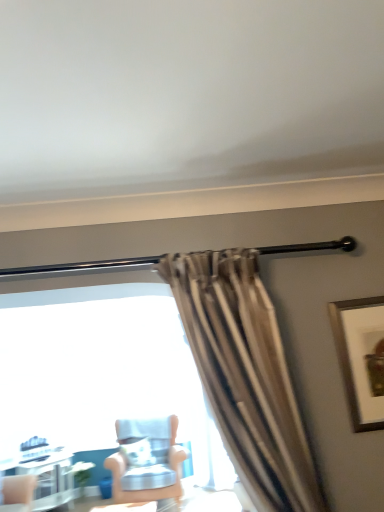
Question: Is wooden framed artwork at upper right oriented towards light blue fabric chair at center?

Choices:
 (A) no
 (B) yes

Answer: (A)

Question: From the image's perspective, is wooden framed artwork at upper right above light blue fabric chair at center?

Choices:
 (A) yes
 (B) no

Answer: (A)

Question: Is wooden framed artwork at upper right thinner than light blue fabric chair at center?

Choices:
 (A) yes
 (B) no

Answer: (A)

Question: Does wooden framed artwork at upper right touch light blue fabric chair at center?

Choices:
 (A) no
 (B) yes

Answer: (A)

Question: From the image's perspective, is wooden framed artwork at upper right below light blue fabric chair at center?

Choices:
 (A) no
 (B) yes

Answer: (A)

Question: Is wooden framed artwork at upper right wider or thinner than light blue fabric chair at center?

Choices:
 (A) thin
 (B) wide

Answer: (A)

Question: Choose the correct answer: Is wooden framed artwork at upper right inside light blue fabric chair at center or outside it?

Choices:
 (A) inside
 (B) outside

Answer: (B)

Question: Is wooden framed artwork at upper right taller or shorter than light blue fabric chair at center?

Choices:
 (A) short
 (B) tall

Answer: (A)

Question: Relative to light blue fabric chair at center, is wooden framed artwork at upper right in front or behind?

Choices:
 (A) behind
 (B) front

Answer: (B)

Question: From the image's perspective, relative to wooden framed artwork at upper right, is white glossy table at lower left above or below?

Choices:
 (A) above
 (B) below

Answer: (B)

Question: In the image, is white glossy table at lower left positioned in front of or behind wooden framed artwork at upper right?

Choices:
 (A) behind
 (B) front

Answer: (A)

Question: Do you think white glossy table at lower left is within wooden framed artwork at upper right, or outside of it?

Choices:
 (A) inside
 (B) outside

Answer: (B)

Question: Considering the positions of point (36, 499) and point (362, 422), is point (36, 499) closer or farther from the camera than point (362, 422)?

Choices:
 (A) closer
 (B) farther

Answer: (B)

Question: From a real-world perspective, is white glossy table at lower left above or below light blue fabric chair at center?

Choices:
 (A) above
 (B) below

Answer: (B)

Question: Which is correct: white glossy table at lower left is inside light blue fabric chair at center, or outside of it?

Choices:
 (A) outside
 (B) inside

Answer: (A)